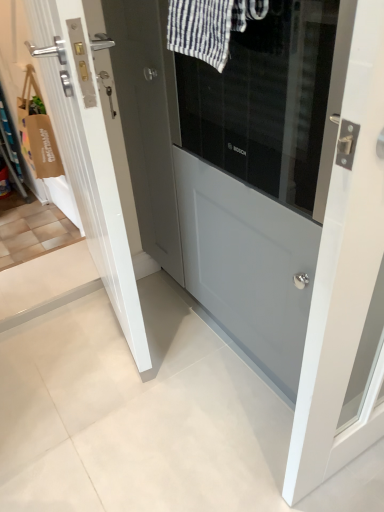
Question: Is point (208, 34) closer or farther from the camera than point (142, 360)?

Choices:
 (A) farther
 (B) closer

Answer: (B)

Question: Considering their positions, is white striped fabric at upper center located in front of or behind white glossy door at center, which ranks as the first door in left-to-right order?

Choices:
 (A) behind
 (B) front

Answer: (B)

Question: Which object is the farthest from the matte gray door at center, the 2th door viewed from the left?

Choices:
 (A) white glossy door at center, the 2th door from the right
 (B) white striped fabric at upper center

Answer: (B)

Question: Estimate the real-world distances between objects in this image. Which object is farther from the white glossy door at center, the 2th door from the right?

Choices:
 (A) white striped fabric at upper center
 (B) matte gray door at center, the 2th door viewed from the left

Answer: (A)